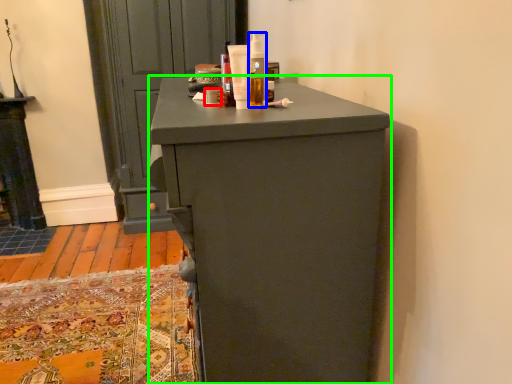
Question: Based on their relative distances, which object is nearer to toiletry (highlighted by a red box)? Choose from toiletry (highlighted by a blue box) and chest of drawers (highlighted by a green box).

Choices:
 (A) toiletry
 (B) chest of drawers

Answer: (A)